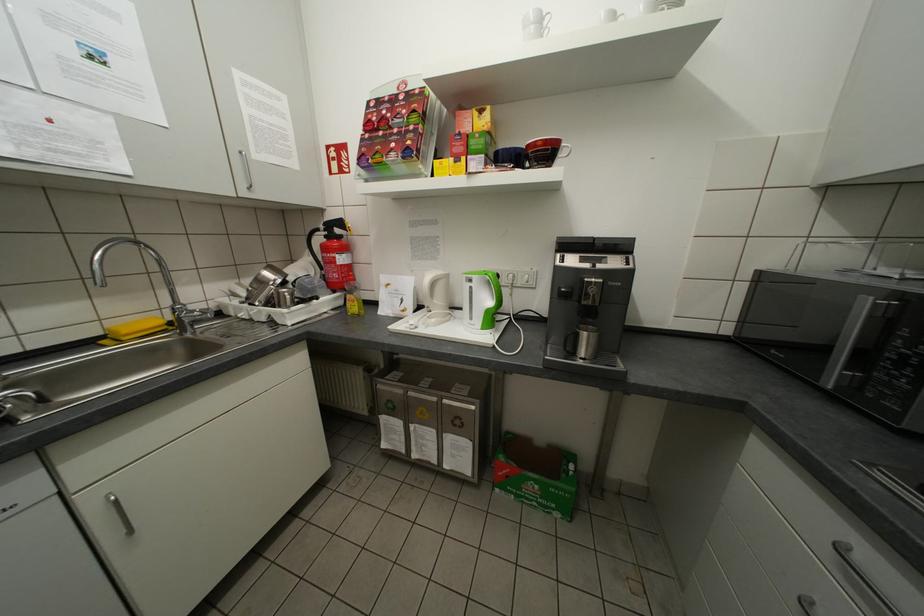
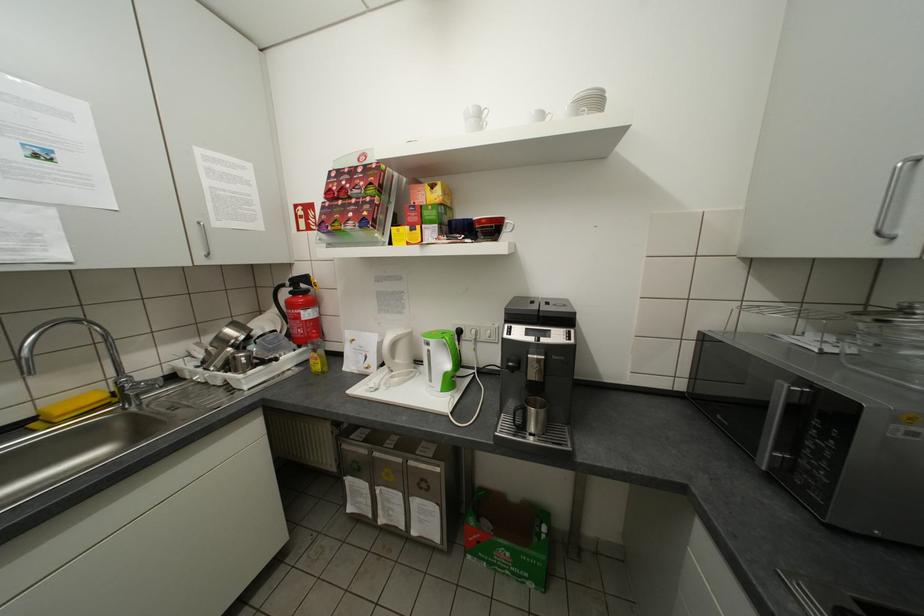
Find the pixel in the second image that matches point (181, 309) in the first image.

(126, 383)